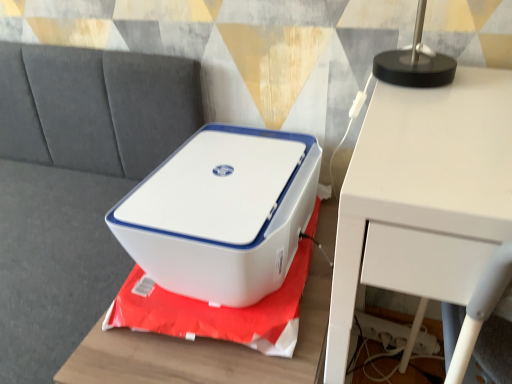
Question: Looking at their shapes, would you say white plastic printer at center is wider or thinner than gray fabric couch at upper left?

Choices:
 (A) wide
 (B) thin

Answer: (B)

Question: Is white plastic printer at center to the left or to the right of gray fabric couch at upper left in the image?

Choices:
 (A) right
 (B) left

Answer: (A)

Question: Which object is positioned farthest from the gray fabric couch at upper left?

Choices:
 (A) white plastic printer at center
 (B) white plastic printer at center
 (C) white matte table at upper right

Answer: (C)

Question: Which object is the farthest from the white plastic printer at center?

Choices:
 (A) white matte table at upper right
 (B) white plastic printer at center
 (C) gray fabric couch at upper left

Answer: (C)